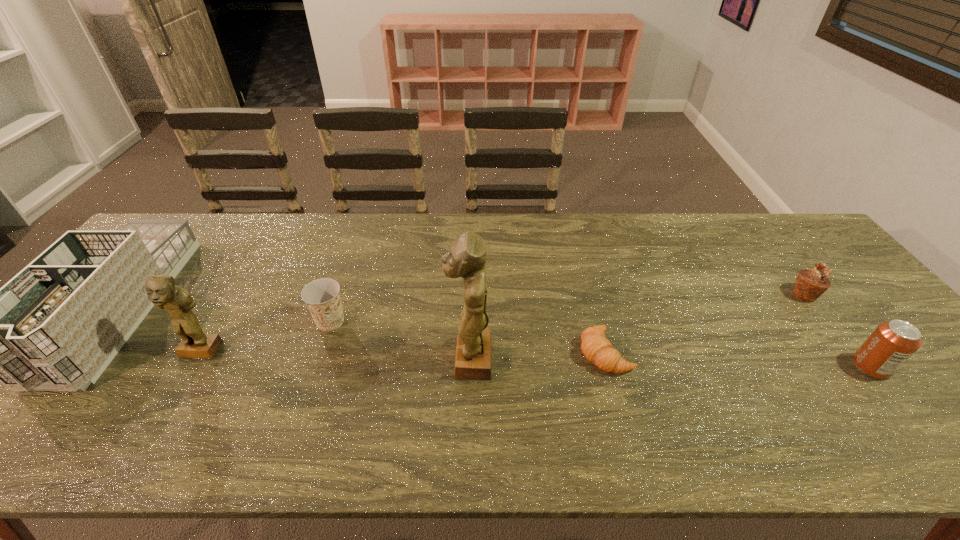
Select which object is the fifth closest to the fifth object from left to right. Please provide its 2D coordinates. Your answer should be formatted as a tuple, i.e. [(x, y)], where the tuple contains the x and y coordinates of a point satisfying the conditions above.

[(161, 289)]

Identify the location of the fifth closest object relative to the crescent roll. This screenshot has width=960, height=540. (161, 289).

The image size is (960, 540). In order to click on vacant region that satisfies the following two spatial constraints: 1. at the entrance of the fifth object from left to right; 2. on the left side of the dollhouse in this screenshot , I will do `click(84, 353)`.

Where is `vacant point that satisfies the following two spatial constraints: 1. on the front-facing side of the shorter figurine; 2. on the right side of the can`? vacant point that satisfies the following two spatial constraints: 1. on the front-facing side of the shorter figurine; 2. on the right side of the can is located at coordinates click(x=191, y=367).

Locate an element on the screen. The height and width of the screenshot is (540, 960). free space that satisfies the following two spatial constraints: 1. at the entrance of the fourth shortest object; 2. on the right side of the fifth shortest object is located at coordinates (71, 367).